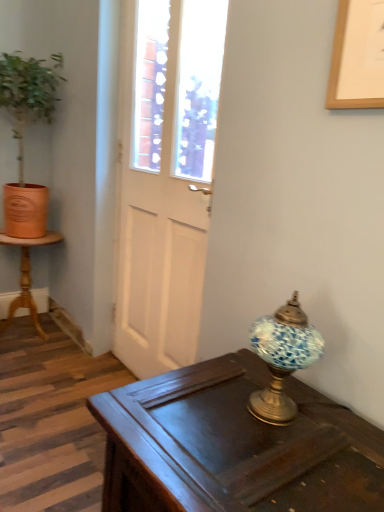
You are a GUI agent. You are given a task and a screenshot of the screen. Output one action in this format:
    pyautogui.click(x=<x>, y=<y>)
    Task: Click on the vacant area located to the right-hand side of blue mosaic glass lamp at right
    The height and width of the screenshot is (512, 384).
    Given the screenshot: What is the action you would take?
    pyautogui.click(x=343, y=421)